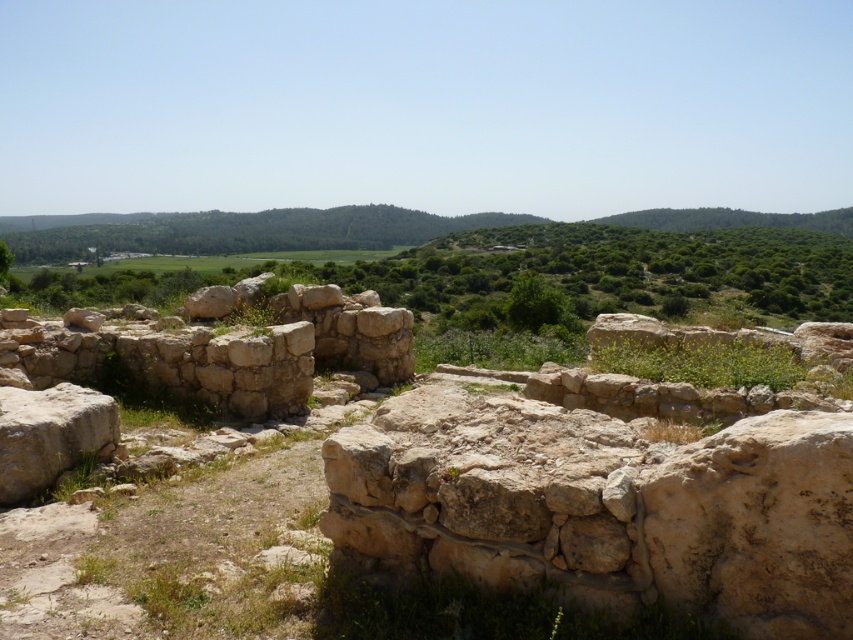
You are an archaeologist examining the ancient stone ruins. You notice the light beige stone wall at center and the light brown stone boulder at lower left. Which object takes up more area in the scene?

The light brown stone boulder at lower left occupies more space than the light beige stone wall at center, so it takes up more area in the scene.

You are an archaeologist examining the ancient stone ruins. You notice the light beige stone wall at center and the light brown stone boulder at lower left. Which structure is taller?

The light brown stone boulder at lower left is taller than the light beige stone wall at center.

You are an archaeologist measuring the widths of ancient stone structures in the ruins. You have a measuring tape that can only extend up to 2 meters. You need to measure the light beige stone wall at center and the light brown stone boulder at lower left. Which object can you measure completely with your tape?

The light beige stone wall at center has a width less than the light brown stone boulder at lower left. Since the tape can extend up to 2 meters, if the boulder is wider than 2 meters, the wall might still be measurable. However, without specific measurements, we can only state that the wall is narrower than the boulder. Therefore, the light beige stone wall at center can be measured completely if its width is under 2 meters, but the boulder might exceed the tape length. However, since the question asks for